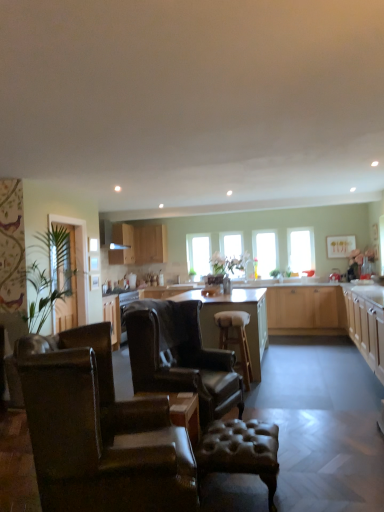
Image resolution: width=384 pixels, height=512 pixels. I want to click on clear glass window at center, which is the fourth window in right-to-left order, so click(198, 254).

The height and width of the screenshot is (512, 384). What do you see at coordinates (198, 254) in the screenshot? I see `clear glass window at center, which is the fourth window in right-to-left order` at bounding box center [198, 254].

Describe the element at coordinates (139, 244) in the screenshot. I see `light wood cabinet at upper center, positioned as the second cabinetry in front-to-back order` at that location.

This screenshot has width=384, height=512. What do you see at coordinates (240, 451) in the screenshot?
I see `leather tufted bar stool at center, the 1th bar stool positioned from the front` at bounding box center [240, 451].

Describe the element at coordinates (78, 261) in the screenshot. I see `clear glass door at left` at that location.

What do you see at coordinates (301, 249) in the screenshot? The width and height of the screenshot is (384, 512). I see `clear glass window at upper center, which appears as the fourth window when viewed from the left` at bounding box center [301, 249].

What is the approximate height of transparent glass window at center, the third window from the left?

37.75 inches.

This screenshot has width=384, height=512. What do you see at coordinates (265, 251) in the screenshot?
I see `transparent glass window at center, the third window from the left` at bounding box center [265, 251].

Identify the location of clear glass window at center, the first window positioned from the left. (198, 254).

The width and height of the screenshot is (384, 512). What are the coordinates of `the 4th window behind when counting from the leather stool at center` in the screenshot? It's located at (198, 254).

Is clear glass window at center, the first window positioned from the left, completely or partially outside of leather stool at center?

Yes, clear glass window at center, the first window positioned from the left, is not within leather stool at center.

Which object is closer to the camera, clear glass window at center, which is the fourth window in right-to-left order, or leather stool at center?

leather stool at center is in front.

Between clear glass door at left and leather tufted bar stool at center, the second bar stool positioned from the back, which one has larger size?

clear glass door at left.

This screenshot has width=384, height=512. I want to click on glass door above the leather tufted bar stool at center, the second bar stool positioned from the back (from a real-world perspective), so click(x=78, y=261).

Is clear glass door at left next to leather tufted bar stool at center, the 1th bar stool positioned from the front, and touching it?

clear glass door at left and leather tufted bar stool at center, the 1th bar stool positioned from the front, are not in contact.

Could you tell me if clear glass door at left is turned towards leather tufted bar stool at center, the 1th bar stool positioned from the front?

No, clear glass door at left is not facing towards leather tufted bar stool at center, the 1th bar stool positioned from the front.

Considering the sizes of objects leather stool at center and clear glass door at left in the image provided, who is taller, leather stool at center or clear glass door at left?

clear glass door at left is taller.

Which object is further away from the camera taking this photo, leather stool at center or clear glass door at left?

Positioned behind is clear glass door at left.

Where is `glass door above the leather stool at center (from a real-world perspective)`? Image resolution: width=384 pixels, height=512 pixels. glass door above the leather stool at center (from a real-world perspective) is located at coordinates (78, 261).

From the image's perspective, does leather wingback chair at center, which is counted as the second chair, starting from the front, appear higher than leather tufted bar stool at center, the 1th bar stool positioned from the front?

Yes, from the image's perspective, leather wingback chair at center, which is counted as the second chair, starting from the front, is above leather tufted bar stool at center, the 1th bar stool positioned from the front.

Which point is more distant from viewer, (186, 336) or (257, 457)?

Positioned behind is point (186, 336).

Is leather wingback chair at center, which is counted as the second chair, starting from the front, thinner than leather tufted bar stool at center, the 1th bar stool positioned from the front?

Incorrect, the width of leather wingback chair at center, which is counted as the second chair, starting from the front, is not less than that of leather tufted bar stool at center, the 1th bar stool positioned from the front.

Measure the distance between leather chair at left, positioned as the 2th chair in back-to-front order, and leather tufted bar stool at center, the 1th bar stool positioned from the front.

The distance of leather chair at left, positioned as the 2th chair in back-to-front order, from leather tufted bar stool at center, the 1th bar stool positioned from the front, is 21.73 inches.

Where is `the 1st bar stool to the right when counting from the leather chair at left, positioned as the 2th chair in back-to-front order`? The width and height of the screenshot is (384, 512). the 1st bar stool to the right when counting from the leather chair at left, positioned as the 2th chair in back-to-front order is located at coordinates (240, 451).

Are leather chair at left, acting as the first chair starting from the front, and leather tufted bar stool at center, the second bar stool positioned from the back, far apart?

leather chair at left, acting as the first chair starting from the front, is actually quite close to leather tufted bar stool at center, the second bar stool positioned from the back.

Between leather chair at left, acting as the first chair starting from the front, and leather tufted bar stool at center, the second bar stool positioned from the back, which one has larger size?

Bigger between the two is leather chair at left, acting as the first chair starting from the front.

Which is closer to the camera, (313, 256) or (209, 397)?

The point (209, 397) is in front.

Which is more to the left, clear glass window at upper center, which appears as the fourth window when viewed from the left, or leather wingback chair at center, which is counted as the second chair, starting from the front?

From the viewer's perspective, leather wingback chair at center, which is counted as the second chair, starting from the front, appears more on the left side.

Is leather wingback chair at center, arranged as the first chair when viewed from the back, inside clear glass window at upper center, which is the first window from right to left?

No, clear glass window at upper center, which is the first window from right to left, does not contain leather wingback chair at center, arranged as the first chair when viewed from the back.

Is light wood cabinet at upper center, positioned as the second cabinetry in front-to-back order, to the left of light wood/finished cabinet at right, which is the first cabinetry from right to left, from the viewer's perspective?

Yes, light wood cabinet at upper center, positioned as the second cabinetry in front-to-back order, is to the left of light wood/finished cabinet at right, which is the first cabinetry from right to left.

Are light wood cabinet at upper center, positioned as the second cabinetry in front-to-back order, and light wood/finished cabinet at right, which is the third cabinetry in back-to-front order, far apart?

light wood cabinet at upper center, positioned as the second cabinetry in front-to-back order, is positioned a significant distance from light wood/finished cabinet at right, which is the third cabinetry in back-to-front order.

Locate an element on the screen. the 1st cabinetry behind the light wood/finished cabinet at right, placed as the third cabinetry when sorted from left to right is located at coordinates (139, 244).

What's the angular difference between light wood cabinet at upper center, the 2th cabinetry viewed from the back, and light wood/finished cabinet at right, placed as the third cabinetry when sorted from left to right,'s facing directions?

There is a 179-degree angle between the facing directions of light wood cabinet at upper center, the 2th cabinetry viewed from the back, and light wood/finished cabinet at right, placed as the third cabinetry when sorted from left to right.

The image size is (384, 512). Find the location of `window that appears on the left of leather stool at center`. window that appears on the left of leather stool at center is located at coordinates (198, 254).

Where is `bar stool that is the 2nd object located below the clear glass door at left (from the image's perspective)`? bar stool that is the 2nd object located below the clear glass door at left (from the image's perspective) is located at coordinates (240, 451).

Which object lies further to the anchor point light wood cabinet at upper center, which is the 1th cabinetry from left to right, light wood cabinet at upper center, which ranks as the 2th cabinetry in left-to-right order, or leather wingback chair at center, arranged as the first chair when viewed from the back?

Based on the image, leather wingback chair at center, arranged as the first chair when viewed from the back, appears to be further to light wood cabinet at upper center, which is the 1th cabinetry from left to right.

Based on their spatial positions, is leather tufted bar stool at center, the second bar stool positioned from the back, or transparent glass window at center, the third window from the left, closer to clear glass window at center, which is the fourth window in right-to-left order?

The object closer to clear glass window at center, which is the fourth window in right-to-left order, is transparent glass window at center, the third window from the left.

From the image, which object appears to be farther from clear glass window at upper center, which appears as the fourth window when viewed from the left, leather chair at left, positioned as the 2th chair in back-to-front order, or light brown wood countertop at center?

leather chair at left, positioned as the 2th chair in back-to-front order, is further to clear glass window at upper center, which appears as the fourth window when viewed from the left.

From the image, which object appears to be nearer to leather tufted bar stool at center, the 1th bar stool positioned from the front, light wood/finished cabinet at right, which is the third cabinetry in back-to-front order, or light brown wood countertop at center?

→ Among the two, light wood/finished cabinet at right, which is the third cabinetry in back-to-front order, is located nearer to leather tufted bar stool at center, the 1th bar stool positioned from the front.

From the image, which object appears to be nearer to light wood cabinet at upper center, marked as the third cabinetry in a front-to-back arrangement, clear glass window at center, which is the third window in right-to-left order, or light wood cabinet at upper center, which ranks as the 2th cabinetry in left-to-right order?

light wood cabinet at upper center, which ranks as the 2th cabinetry in left-to-right order, lies closer to light wood cabinet at upper center, marked as the third cabinetry in a front-to-back arrangement, than the other object.

Considering their positions, is transparent glass window at center, the second window when ordered from right to left, positioned further to white leather bar stool at center, the 2th bar stool in the front-to-back sequence, than light wood/finished cabinet at right, marked as the 1th cabinetry in a front-to-back arrangement?

Among the two, transparent glass window at center, the second window when ordered from right to left, is located further to white leather bar stool at center, the 2th bar stool in the front-to-back sequence.

Looking at the image, which one is located closer to leather stool at center, light wood cabinet at upper center, which ranks as the 2th cabinetry in left-to-right order, or light brown wood countertop at center?

light brown wood countertop at center is closer to leather stool at center.

Considering their positions, is clear glass door at left positioned further to white leather bar stool at center, positioned as the first bar stool in back-to-front order, than clear glass window at upper center, which appears as the fourth window when viewed from the left?

clear glass window at upper center, which appears as the fourth window when viewed from the left, lies further to white leather bar stool at center, positioned as the first bar stool in back-to-front order, than the other object.

Find the location of a particular element. The height and width of the screenshot is (512, 384). bar stool between light wood/finished cabinet at right, which is the first cabinetry from right to left, and clear glass window at upper center, which is the first window from right to left, in the front-back direction is located at coordinates (236, 339).

The height and width of the screenshot is (512, 384). Find the location of `bar stool between leather stool at center and light wood/finished cabinet at right, which is the third cabinetry in back-to-front order, in the horizontal direction`. bar stool between leather stool at center and light wood/finished cabinet at right, which is the third cabinetry in back-to-front order, in the horizontal direction is located at coordinates (236, 339).

The width and height of the screenshot is (384, 512). Identify the location of table positioned between leather wingback chair at center, which is counted as the second chair, starting from the front, and clear glass window at upper center, which is the first window from right to left, from near to far. (234, 310).

Where is `window positioned between leather wingback chair at center, which is counted as the second chair, starting from the front, and transparent glass window at center, the second window when ordered from right to left, from near to far`? Image resolution: width=384 pixels, height=512 pixels. window positioned between leather wingback chair at center, which is counted as the second chair, starting from the front, and transparent glass window at center, the second window when ordered from right to left, from near to far is located at coordinates (301, 249).